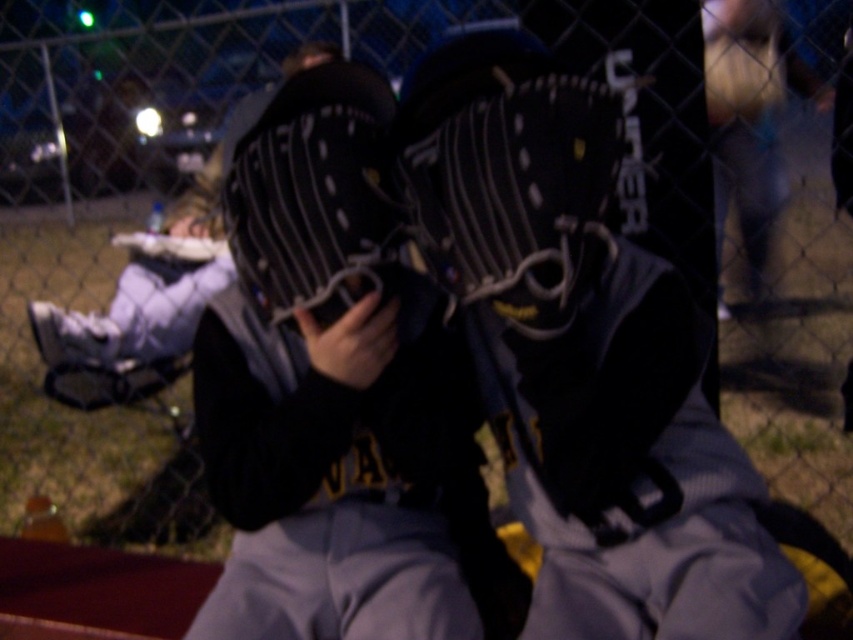
Is dark blue jersey at center thinner than black leather baseball glove at center?

No.

Is point (517, 460) positioned after point (502, 42)?

Yes.

At what (x,y) coordinates should I click in order to perform the action: click on dark blue jersey at center. Please return your answer as a coordinate pair (x, y). Image resolution: width=853 pixels, height=640 pixels. Looking at the image, I should click on (630, 470).

Is dark blue jersey at center thinner than black leather baseball glove at left?

Indeed, dark blue jersey at center has a lesser width compared to black leather baseball glove at left.

Who is positioned more to the left, dark blue jersey at center or black leather baseball glove at left?

Positioned to the left is black leather baseball glove at left.

Is point (579, 472) in front of point (134, 285)?

Yes.

This screenshot has width=853, height=640. In order to click on dark blue jersey at center in this screenshot , I will do `click(630, 470)`.

Does dark blue jersey at center have a greater width compared to black matte baseball uniform at center?

In fact, dark blue jersey at center might be narrower than black matte baseball uniform at center.

Based on the photo, is dark blue jersey at center shorter than black matte baseball uniform at center?

No.

Where is `dark blue jersey at center`? dark blue jersey at center is located at coordinates (630, 470).